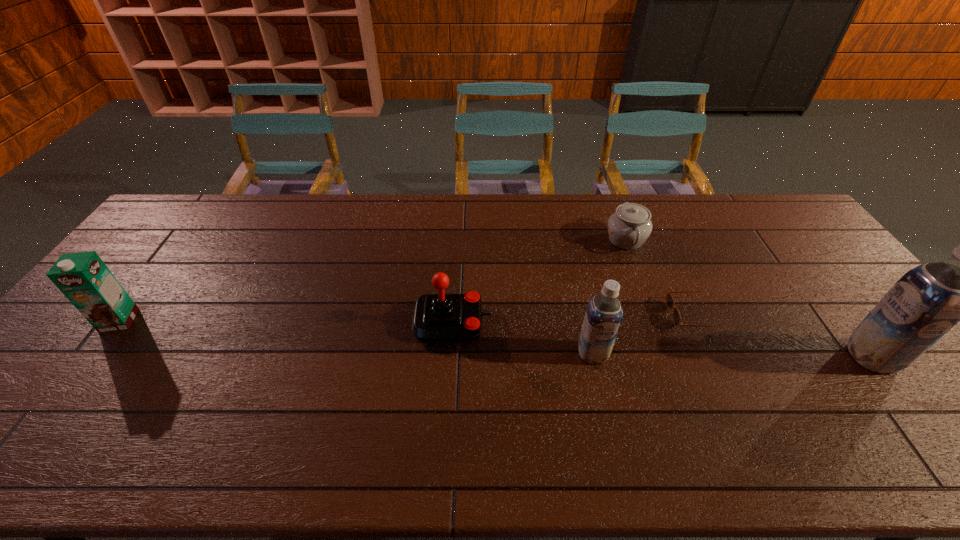
Locate an element on the screen. vacant space located 0.090m on the label of the shorter soya milk is located at coordinates (603, 397).

This screenshot has height=540, width=960. I want to click on vacant region located on the label of the right soya milk, so click(815, 357).

The width and height of the screenshot is (960, 540). I want to click on free space located on the label of the right soya milk, so click(x=733, y=357).

In order to click on free space located 0.390m on the label of the right soya milk in this screenshot , I will do `click(698, 357)`.

Locate an element on the screen. The width and height of the screenshot is (960, 540). free spot located on the left of the farthest object is located at coordinates (587, 240).

Find the location of a particular element. vacant area situated on the front-facing side of the shortest object is located at coordinates (594, 315).

Identify the location of vacant area situated on the front-facing side of the shortest object. The image size is (960, 540). (540, 315).

At what (x,y) coordinates should I click in order to perform the action: click on free space located 0.220m on the front-facing side of the shortest object. Please return your answer as a coordinate pair (x, y). Looking at the image, I should click on (591, 315).

The height and width of the screenshot is (540, 960). I want to click on free region located on the back of the leftmost object, so click(140, 293).

At what (x,y) coordinates should I click in order to perform the action: click on free space located on the base of the joystick. Please return your answer as a coordinate pair (x, y). The height and width of the screenshot is (540, 960). Looking at the image, I should click on (629, 322).